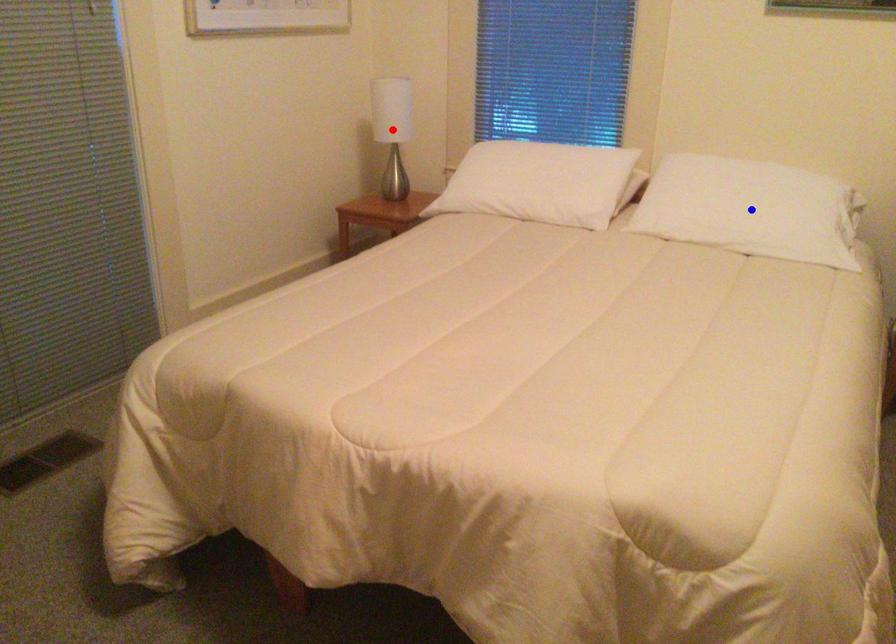
Question: Which of the two points in the image is closer to the camera?

Choices:
 (A) Blue point is closer.
 (B) Red point is closer.

Answer: (A)